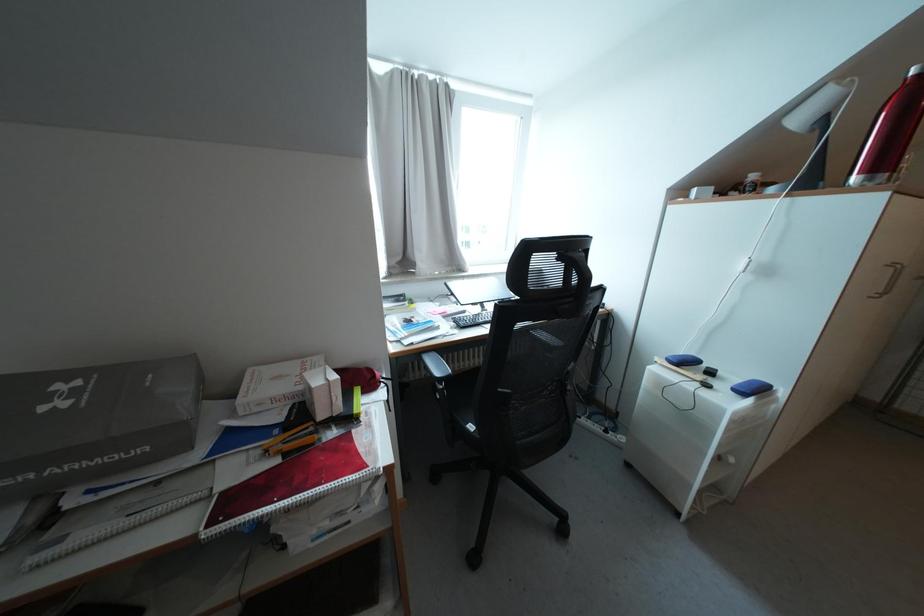
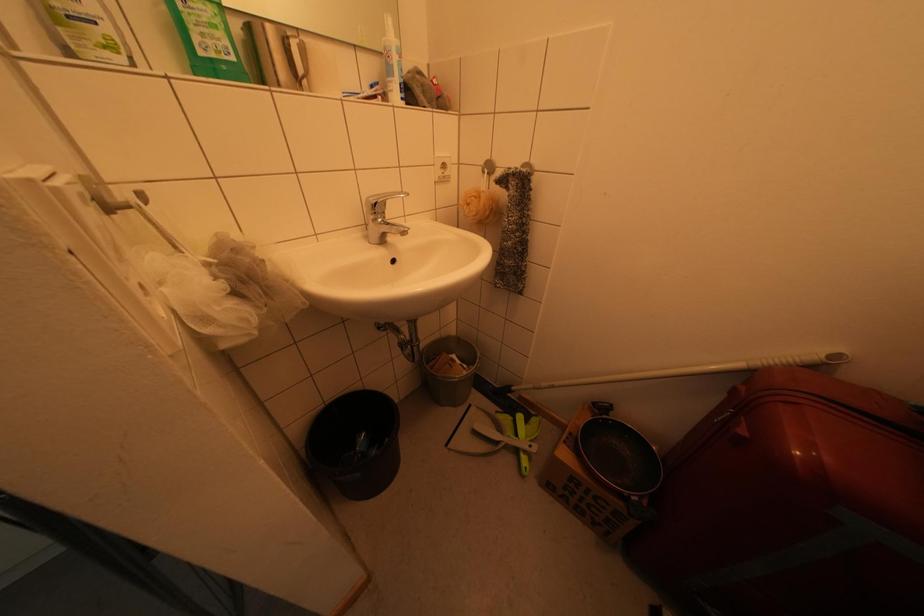
Question: The images are taken continuously from a first-person perspective. In which direction are you moving?

Choices:
 (A) Left
 (B) Right
 (C) Forward
 (D) Backward

Answer: (B)